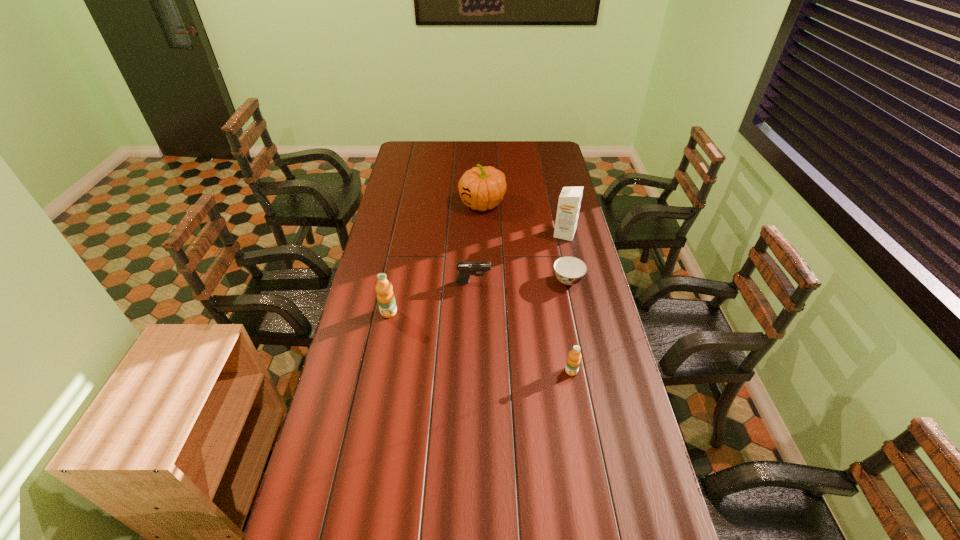
Locate an element on the screen. The height and width of the screenshot is (540, 960). the leftmost object is located at coordinates (385, 296).

Find the location of a particular element. the taller orange juice is located at coordinates (385, 296).

In order to click on the nearer orange juice in this screenshot , I will do `click(573, 361)`.

Locate an element on the screen. The height and width of the screenshot is (540, 960). the shorter orange juice is located at coordinates (573, 361).

Identify the location of carton. The height and width of the screenshot is (540, 960). (569, 202).

At what (x,y) coordinates should I click in order to perform the action: click on the farthest object. Please return your answer as a coordinate pair (x, y). This screenshot has width=960, height=540. Looking at the image, I should click on (480, 188).

You are a GUI agent. You are given a task and a screenshot of the screen. Output one action in this format:
    pyautogui.click(x=<x>, y=<y>)
    Task: Click on the pistol
    Image resolution: width=960 pixels, height=540 pixels.
    Given the screenshot: What is the action you would take?
    pyautogui.click(x=466, y=269)

This screenshot has width=960, height=540. In order to click on soup bowl in this screenshot , I will do `click(569, 270)`.

At what (x,y) coordinates should I click in order to perform the action: click on vacant space located on the label of the farther orange juice. Please return your answer as a coordinate pair (x, y). Looking at the image, I should click on (385, 332).

Locate an element on the screen. The image size is (960, 540). vacant position located 0.050m on the label of the nearest object is located at coordinates (575, 390).